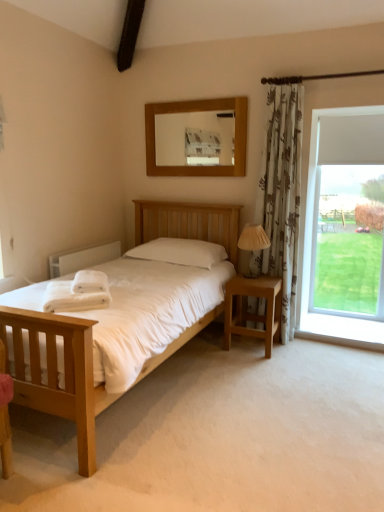
Question: From a real-world perspective, relative to white painted radiator at left, is light wood bed at center vertically above or below?

Choices:
 (A) below
 (B) above

Answer: (A)

Question: Relative to white painted radiator at left, is light wood bed at center in front or behind?

Choices:
 (A) behind
 (B) front

Answer: (B)

Question: Which object is positioned farthest from the light wood bed at center?

Choices:
 (A) wooden mirror at upper center
 (B) white soft towel at lower left
 (C) beige fabric lampshade at right
 (D) white soft towels at left
 (E) transparent glass window at right

Answer: (A)

Question: Which object is the closest to the white soft towel at lower left?

Choices:
 (A) white painted radiator at left
 (B) wooden mirror at upper center
 (C) brown fabric curtain at upper right
 (D) light wood bed at center
 (E) white soft towels at left

Answer: (E)